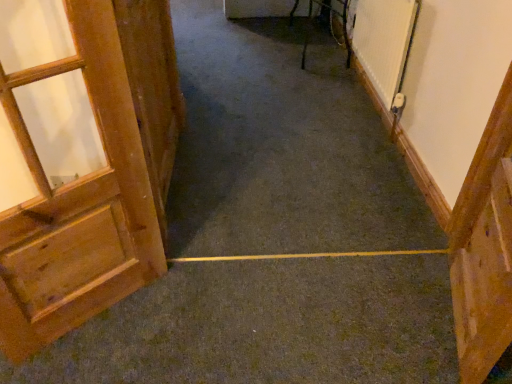
Question: Does wooden door at left, arranged as the 3th door when viewed from the right, turn towards wooden door at right, which appears as the 1th door when viewed from the right?

Choices:
 (A) no
 (B) yes

Answer: (A)

Question: Is wooden door at left, arranged as the 3th door when viewed from the right, completely or partially outside of wooden door at right, the third door in the left-to-right sequence?

Choices:
 (A) yes
 (B) no

Answer: (A)

Question: Is there a large distance between wooden door at left, arranged as the 3th door when viewed from the right, and wooden door at right, the third door in the left-to-right sequence?

Choices:
 (A) yes
 (B) no

Answer: (A)

Question: Are wooden door at left, which is the first door in left-to-right order, and wooden door at right, the third door in the left-to-right sequence, beside each other?

Choices:
 (A) yes
 (B) no

Answer: (B)

Question: Is wooden door at left, arranged as the 3th door when viewed from the right, taller than wooden door at right, which appears as the 1th door when viewed from the right?

Choices:
 (A) no
 (B) yes

Answer: (B)

Question: From a real-world perspective, relative to metallic silver chair at upper right, is wooden door at left, the second door from the right, vertically above or below?

Choices:
 (A) above
 (B) below

Answer: (A)

Question: Relative to metallic silver chair at upper right, is wooden door at left, the second door from the right, in front or behind?

Choices:
 (A) behind
 (B) front

Answer: (B)

Question: Considering the positions of wooden door at left, the second door from the right, and metallic silver chair at upper right in the image, is wooden door at left, the second door from the right, bigger or smaller than metallic silver chair at upper right?

Choices:
 (A) big
 (B) small

Answer: (B)

Question: In terms of width, does wooden door at left, arranged as the 2th door when viewed from the left, look wider or thinner when compared to metallic silver chair at upper right?

Choices:
 (A) thin
 (B) wide

Answer: (A)

Question: Does point (345, 21) appear closer or farther from the camera than point (487, 147)?

Choices:
 (A) farther
 (B) closer

Answer: (A)

Question: From a real-world perspective, relative to wooden door at right, the third door in the left-to-right sequence, is metallic silver chair at upper right vertically above or below?

Choices:
 (A) above
 (B) below

Answer: (B)

Question: Based on their sizes in the image, would you say metallic silver chair at upper right is bigger or smaller than wooden door at right, which appears as the 1th door when viewed from the right?

Choices:
 (A) small
 (B) big

Answer: (B)

Question: From the image's perspective, is metallic silver chair at upper right above or below wooden door at right, the third door in the left-to-right sequence?

Choices:
 (A) below
 (B) above

Answer: (B)

Question: Considering the relative positions of wooden door at right, the third door in the left-to-right sequence, and wooden door at left, which is the first door in left-to-right order, in the image provided, is wooden door at right, the third door in the left-to-right sequence, to the left or to the right of wooden door at left, which is the first door in left-to-right order,?

Choices:
 (A) right
 (B) left

Answer: (A)

Question: Does point (485, 329) appear closer or farther from the camera than point (76, 172)?

Choices:
 (A) farther
 (B) closer

Answer: (B)